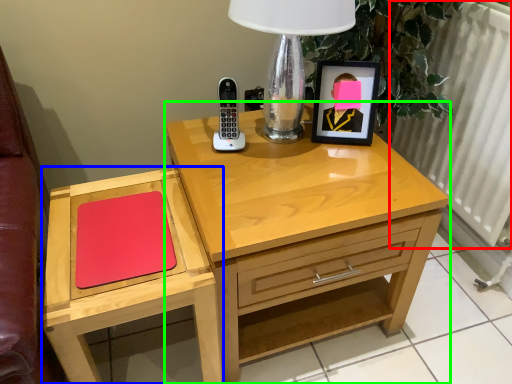
Question: Which object is the farthest from radiator (highlighted by a red box)? Choose among these: chest of drawers (highlighted by a blue box) or nightstand (highlighted by a green box).

Choices:
 (A) chest of drawers
 (B) nightstand

Answer: (A)